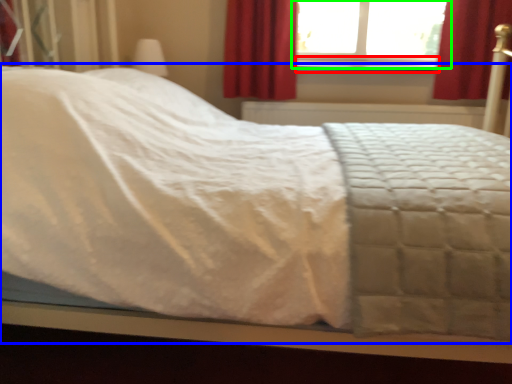
Question: Which is farther away from window sill (highlighted by a red box)? bed (highlighted by a blue box) or window (highlighted by a green box)?

Choices:
 (A) bed
 (B) window

Answer: (A)